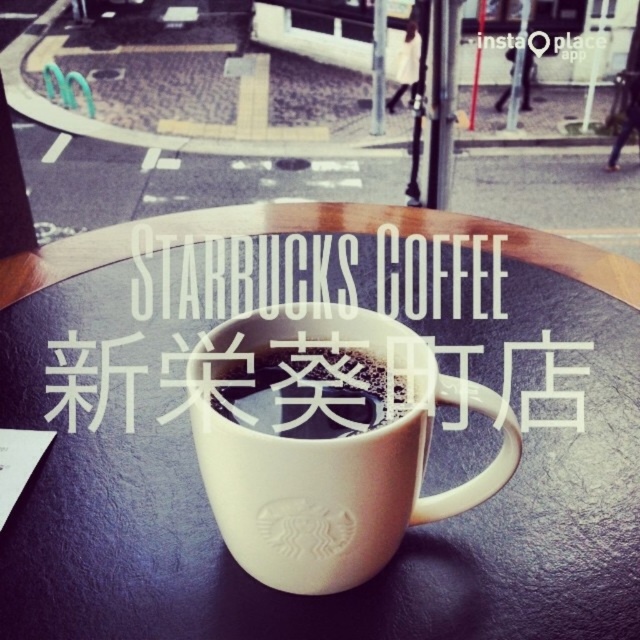
Question: Is white matte table at center bigger than white matte mug at center?

Choices:
 (A) yes
 (B) no

Answer: (A)

Question: Can you confirm if white matte table at center is positioned to the left of white matte mug at center?

Choices:
 (A) yes
 (B) no

Answer: (A)

Question: Which point is closer to the camera?

Choices:
 (A) (413, 342)
 (B) (68, 326)
 (C) (305, 374)
 (D) (131, 378)

Answer: (A)

Question: Does white ceramic mug at center have a greater width compared to white matte text at center?

Choices:
 (A) yes
 (B) no

Answer: (B)

Question: Which point is farther from the camera taking this photo?

Choices:
 (A) (72, 337)
 (B) (275, 429)
 (C) (164, 445)

Answer: (A)

Question: Which object is the farthest from the white ceramic mug at center?

Choices:
 (A) white matte table at center
 (B) white matte mug at center

Answer: (A)